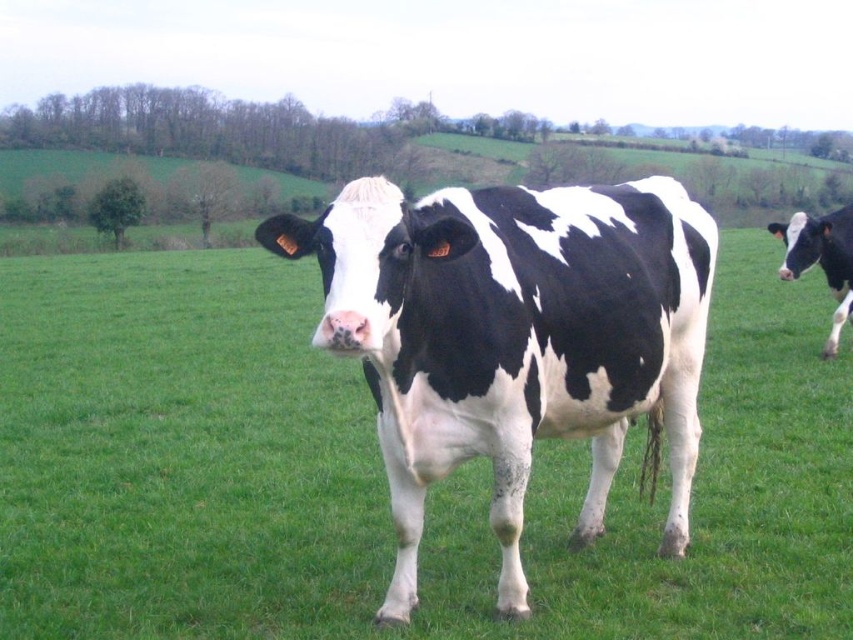
Question: Observing the image, what is the correct spatial positioning of black and white spotted cow at center in reference to black and white cow at right?

Choices:
 (A) left
 (B) right

Answer: (A)

Question: Is black and white spotted cow at center smaller than black and white cow at right?

Choices:
 (A) no
 (B) yes

Answer: (B)

Question: Is the position of black and white spotted cow at center more distant than that of black and white cow at right?

Choices:
 (A) yes
 (B) no

Answer: (B)

Question: Which point is farther to the camera?

Choices:
 (A) [x=834, y=227]
 (B) [x=285, y=253]

Answer: (A)